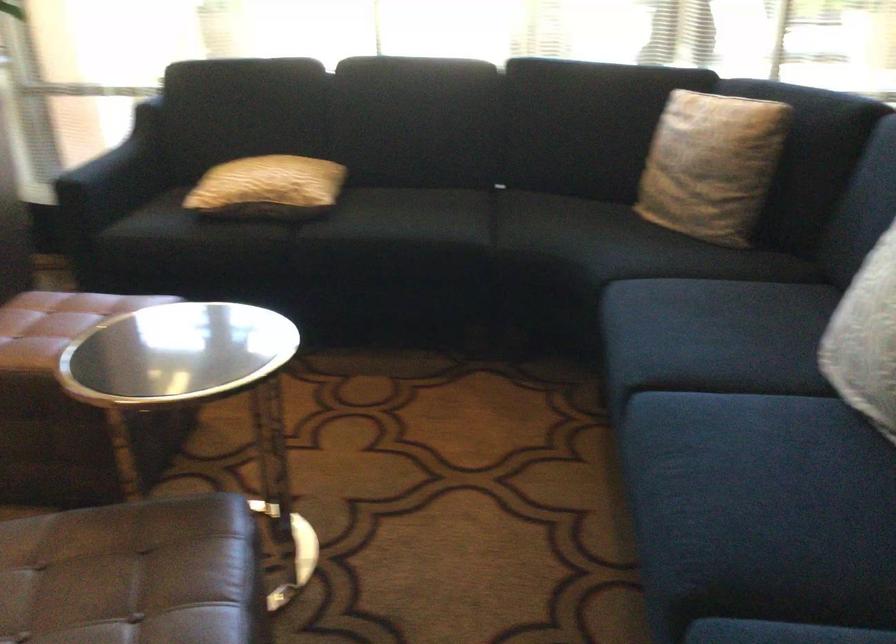
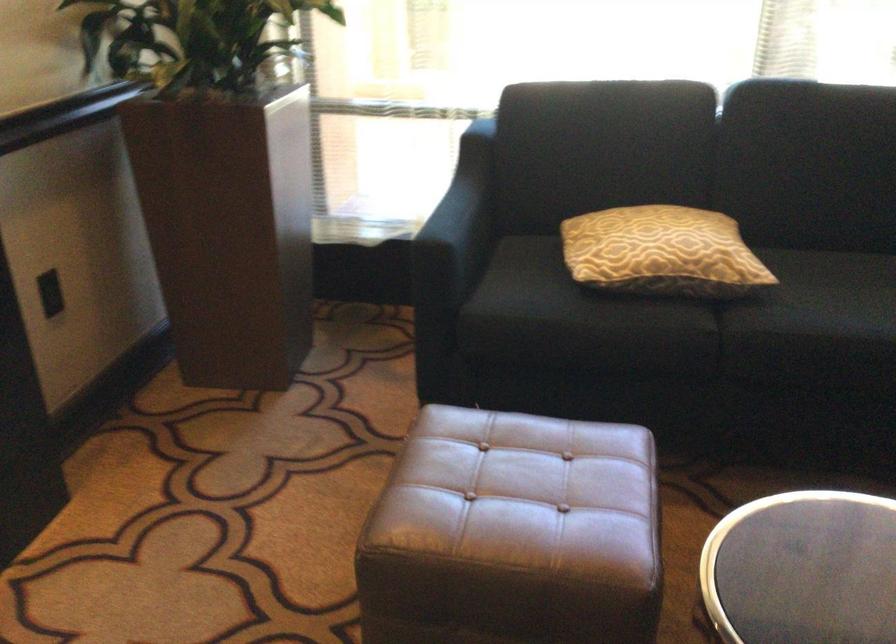
Locate, in the second image, the point that corresponds to the point at 99,167 in the first image.

(458, 225)